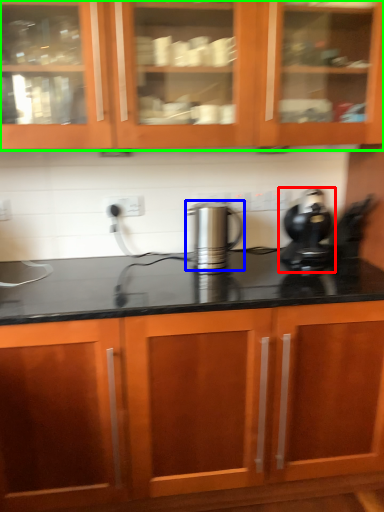
Question: Estimate the real-world distances between objects in this image. Which object is closer to home appliance (highlighted by a red box), kitchen appliance (highlighted by a blue box) or cabinetry (highlighted by a green box)?

Choices:
 (A) kitchen appliance
 (B) cabinetry

Answer: (A)